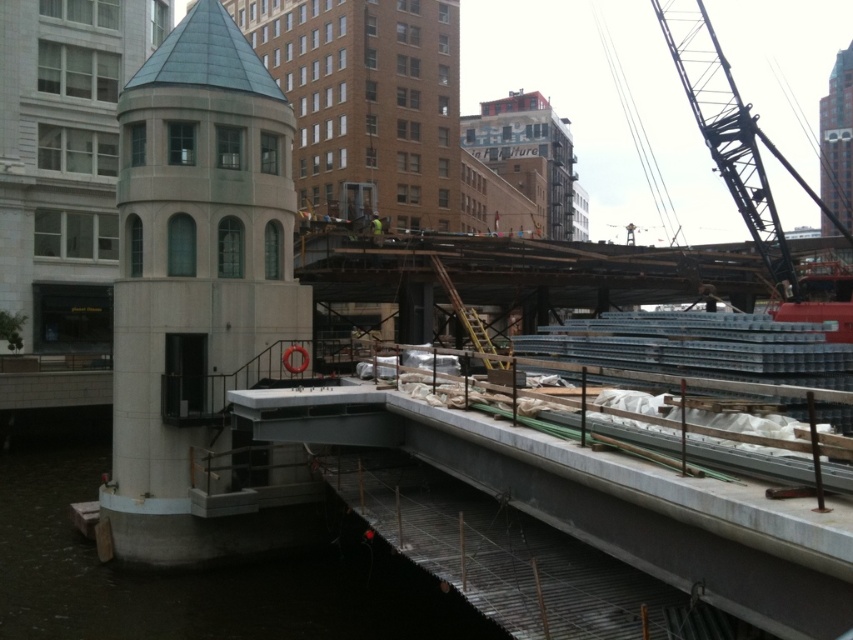
You are a construction worker who needs to transport materials from the metallic industrial crane at upper right to the dark gray concrete waterway at lower left. Considering their widths, which path would you choose to ensure the materials fit without obstruction?

The dark gray concrete waterway at lower left is thinner than the metallic industrial crane at upper right, so you should choose a path that accommodates the narrower width of the dark gray concrete waterway at lower left to ensure materials fit without obstruction.

You are a construction inspector standing at the point marked by the coordinates point (189,570). Based on the scene description, what surface are you currently standing on?

The point (189,570) is on the dark gray concrete waterway at lower left, so you are standing on the dark gray concrete waterway at lower left.

You are a construction worker who needs to transport materials from the dark gray concrete waterway at lower left to the metallic industrial crane at upper right. Considering their sizes, which object requires more space to maneuver around?

The metallic industrial crane at upper right requires more space to maneuver around because it is larger than the dark gray concrete waterway at lower left according to the description.